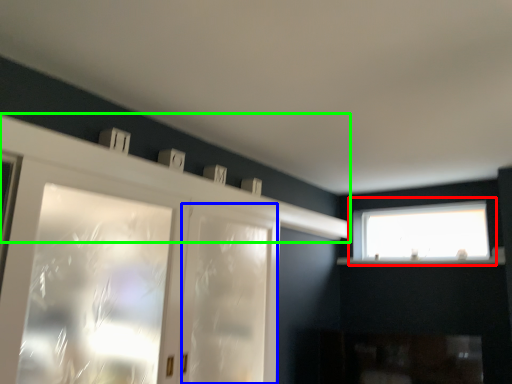
Question: Based on their relative distances, which object is farther from window (highlighted by a red box)? Choose from screen door (highlighted by a blue box) and mantle (highlighted by a green box).

Choices:
 (A) screen door
 (B) mantle

Answer: (A)